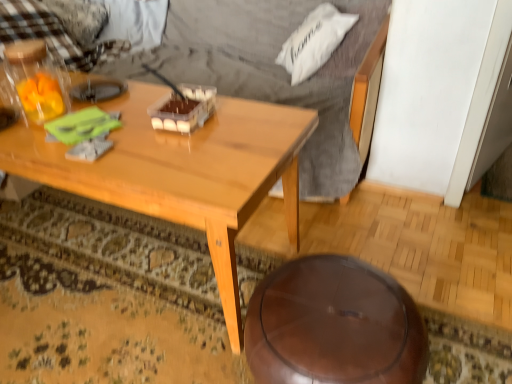
Question: Is point (180, 127) closer or farther from the camera than point (40, 157)?

Choices:
 (A) closer
 (B) farther

Answer: (B)

Question: From a real-world perspective, is translucent plastic container at center above or below light brown wood coffee table at center?

Choices:
 (A) below
 (B) above

Answer: (B)

Question: Which is farther from the shiny brown stool at lower center?

Choices:
 (A) white soft pillow at upper right, the second pillow in the left-to-right sequence
 (B) light brown wood coffee table at center
 (C) checkered fabric pillow at upper left, placed as the 2th pillow when sorted from front to back
 (D) translucent plastic bottle at upper left
 (E) translucent plastic container at center

Answer: (C)

Question: Which is farther from the checkered fabric pillow at upper left, which is the second pillow from right to left?

Choices:
 (A) translucent plastic bottle at upper left
 (B) translucent plastic container at center
 (C) light brown wood coffee table at center
 (D) white soft pillow at upper right, the second pillow in the left-to-right sequence
 (E) shiny brown stool at lower center

Answer: (E)